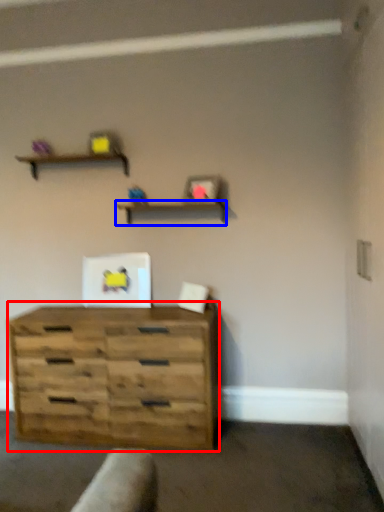
Question: Which object appears closest to the camera in this image, chest of drawers (highlighted by a red box) or shelf (highlighted by a blue box)?

Choices:
 (A) chest of drawers
 (B) shelf

Answer: (A)